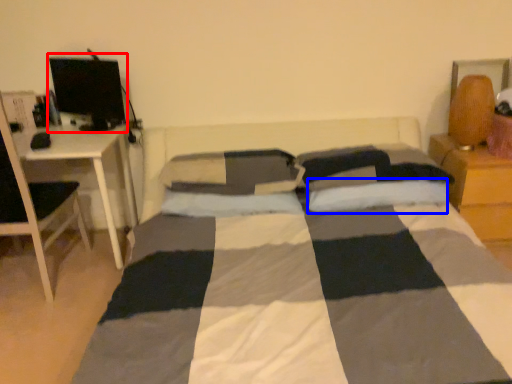
Question: Among these objects, which one is nearest to the camera, computer monitor (highlighted by a red box) or pillow (highlighted by a blue box)?

Choices:
 (A) computer monitor
 (B) pillow

Answer: (B)